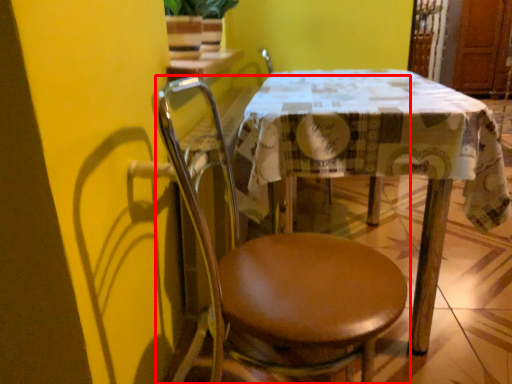
Question: From the image, what is the correct spatial relationship of chair (annotated by the red box) in relation to table?

Choices:
 (A) right
 (B) left

Answer: (B)